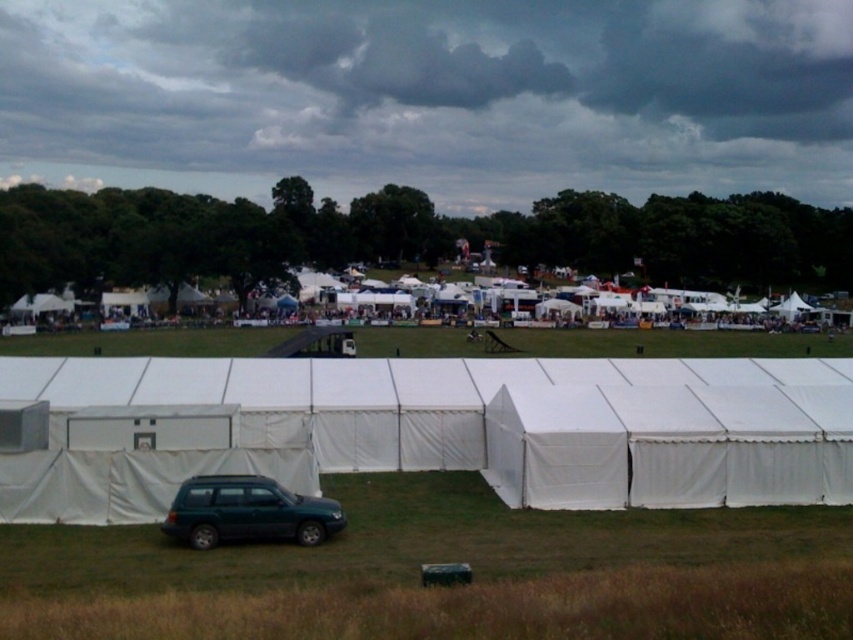
Question: Is green grass at lower center below green grass at center?

Choices:
 (A) no
 (B) yes

Answer: (B)

Question: Is white fabric tent at lower center bigger than teal matte suv at lower center?

Choices:
 (A) yes
 (B) no

Answer: (A)

Question: Which point appears closest to the camera in this image?

Choices:
 (A) (636, 627)
 (B) (204, 524)
 (C) (769, 336)

Answer: (A)

Question: Which is farther from the green grass at center?

Choices:
 (A) white fabric tent at lower center
 (B) teal matte suv at lower center

Answer: (B)

Question: Does white fabric tent at lower center appear over green grass at center?

Choices:
 (A) yes
 (B) no

Answer: (B)

Question: Among these objects, which one is nearest to the camera?

Choices:
 (A) white fabric tent at lower center
 (B) teal matte suv at lower center
 (C) green grass at center
 (D) green grass at lower center

Answer: (D)